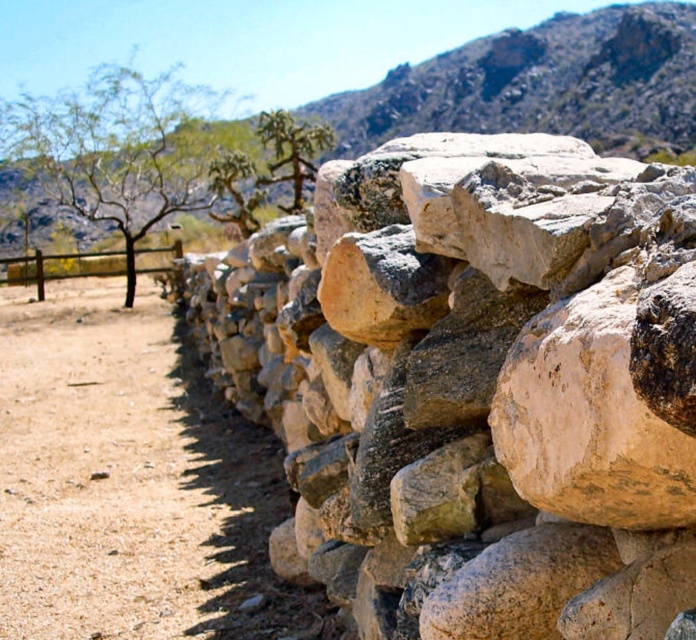
You are standing in the desert and see the natural stone wall at center and the brown wooden fence at left. Which structure is closer to you?

The natural stone wall at center is closer to you because it is positioned under the brown wooden fence at left, indicating it is in front.

You are a hiker in the desert and see the natural stone wall at center and the green spiny at upper center. Which object is larger in size?

The green spiny at upper center is larger than the natural stone wall at center.